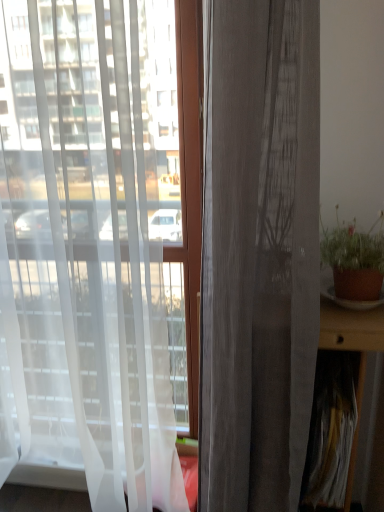
Question: Based on their positions, is white sheer curtain at left, arranged as the 1th curtain when viewed from the left, located to the left or right of brown clay pot at right?

Choices:
 (A) left
 (B) right

Answer: (A)

Question: From a real-world perspective, relative to brown clay pot at right, is white sheer curtain at left, positioned as the second curtain in right-to-left order, vertically above or below?

Choices:
 (A) below
 (B) above

Answer: (A)

Question: Estimate the real-world distances between objects in this image. Which object is farther from the matte gray curtain at center, the 1th curtain in the right-to-left sequence?

Choices:
 (A) brown clay pot at right
 (B) white sheer curtain at left, positioned as the second curtain in right-to-left order
 (C) brown wooden table at right

Answer: (B)

Question: Estimate the real-world distances between objects in this image. Which object is closer to the brown wooden table at right?

Choices:
 (A) brown clay pot at right
 (B) white sheer curtain at left, positioned as the second curtain in right-to-left order
 (C) matte gray curtain at center, which is the 2th curtain in left-to-right order

Answer: (A)